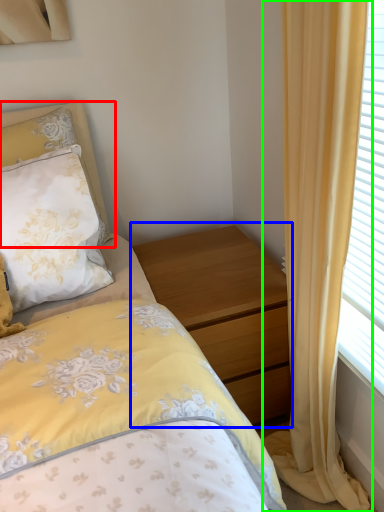
Question: Which object is positioned closest to pillow (highlighted by a red box)? Select from nightstand (highlighted by a blue box) and curtain (highlighted by a green box).

Choices:
 (A) nightstand
 (B) curtain

Answer: (A)